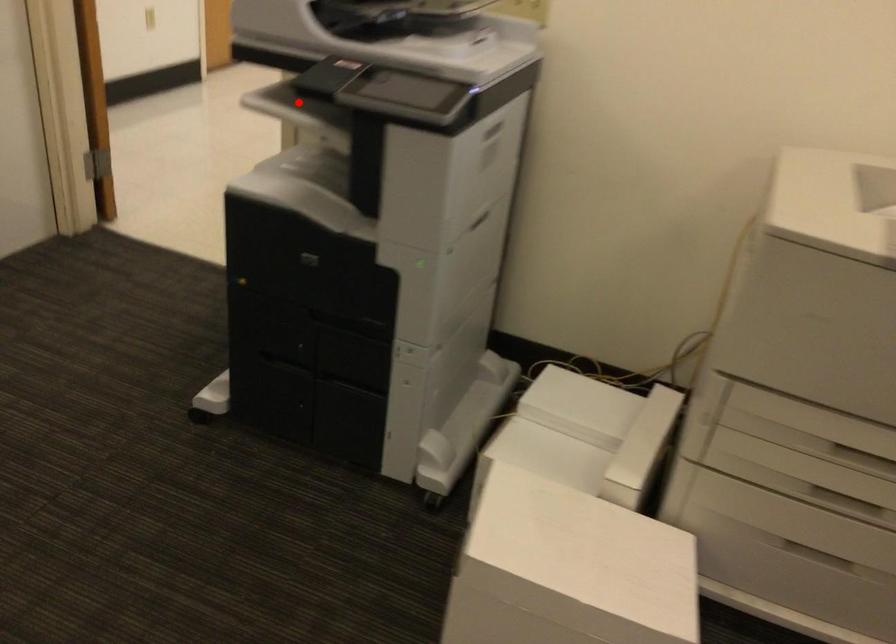
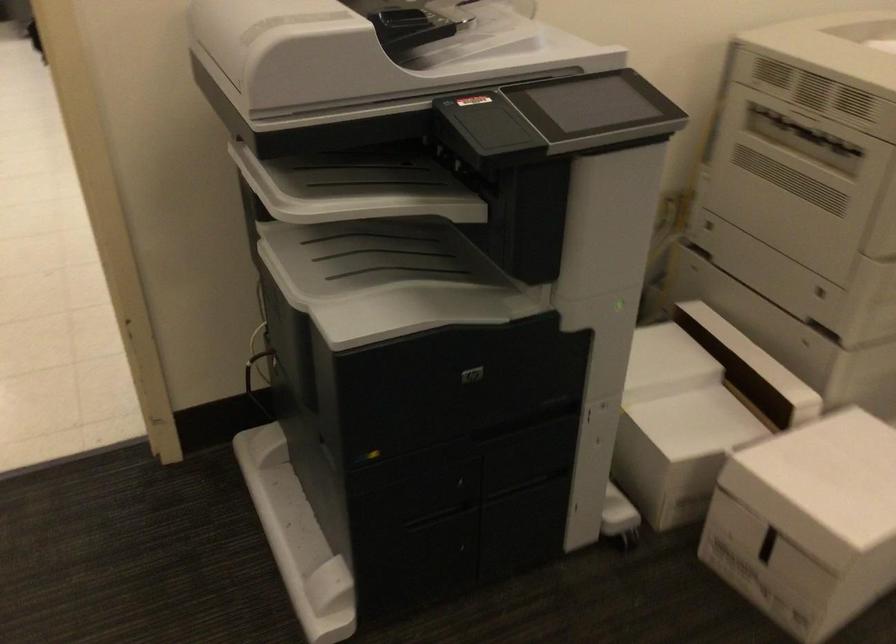
Question: I am providing you with two images of the same scene from different viewpoints. A red point is shown in image1. For the corresponding object point in image2, is it positioned nearer or farther from the camera?

Choices:
 (A) Nearer
 (B) Farther

Answer: (A)